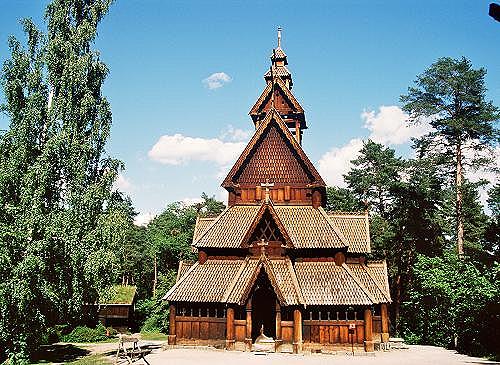
Where is `bench`? bench is located at coordinates (131, 350).